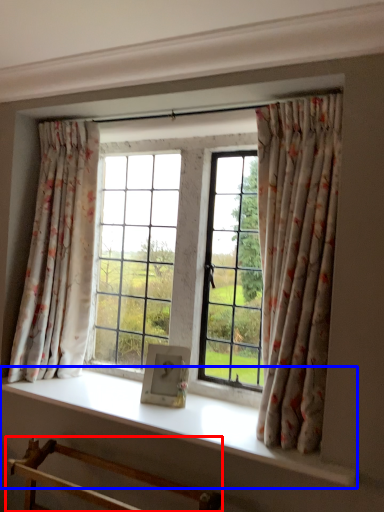
Question: Which of the following is the closest to the observer, furniture (highlighted by a red box) or window sill (highlighted by a blue box)?

Choices:
 (A) furniture
 (B) window sill

Answer: (A)